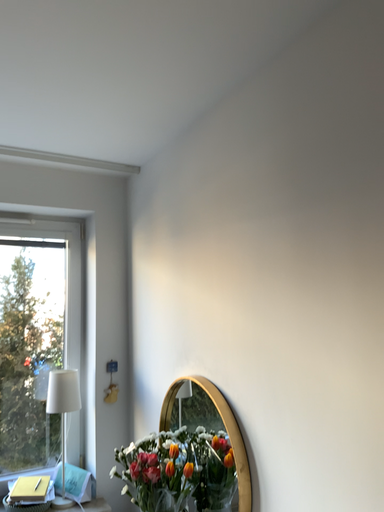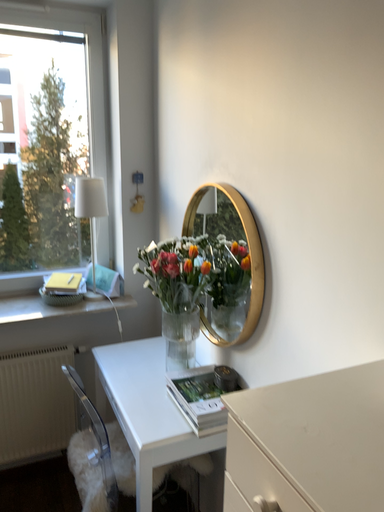
Question: How did the camera likely rotate when shooting the video?

Choices:
 (A) rotated upward
 (B) rotated downward

Answer: (B)